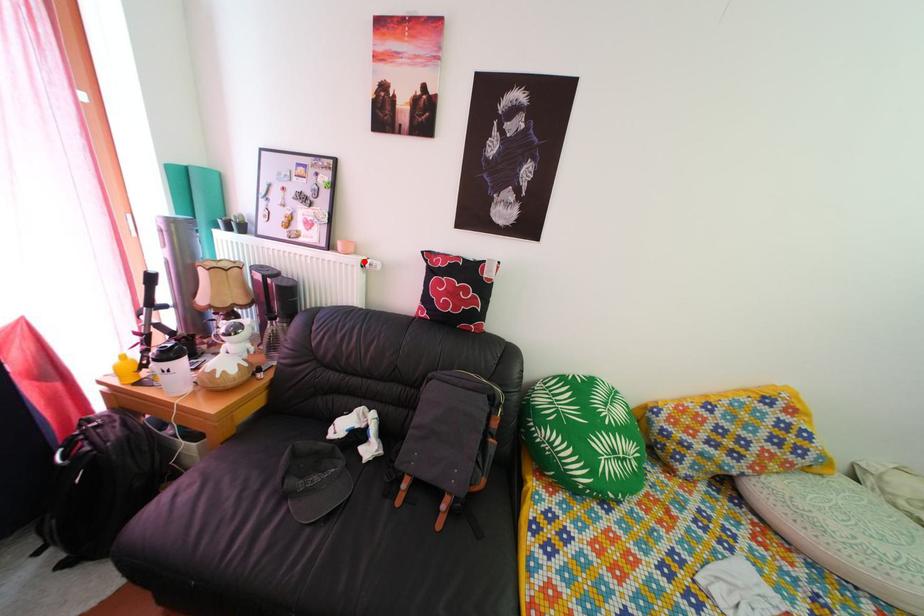
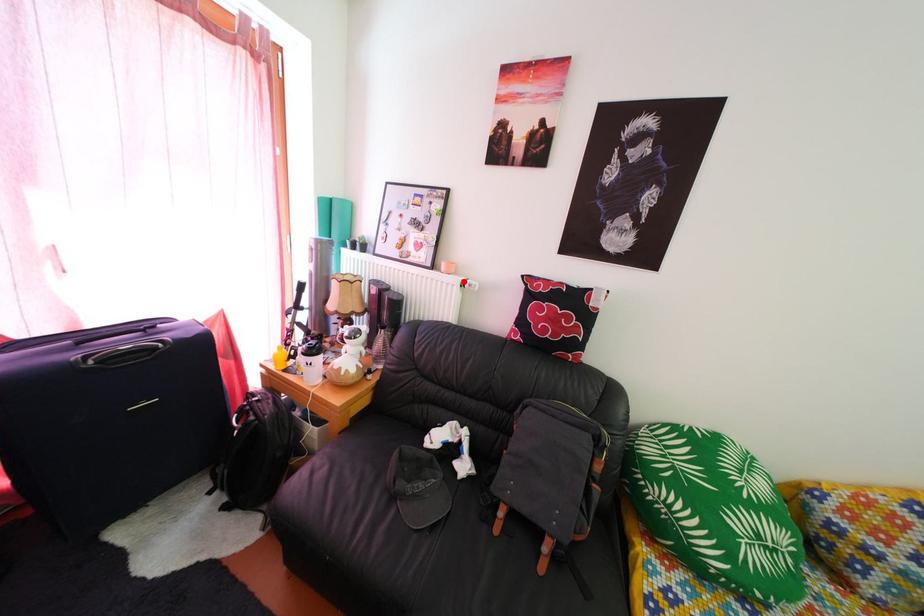
I am providing you with two images of the same scene from different viewpoints. A red point is marked on the first image and another point is marked on the second image. Does the point marked in image1 correspond to the same location as the one in image2?

Yes